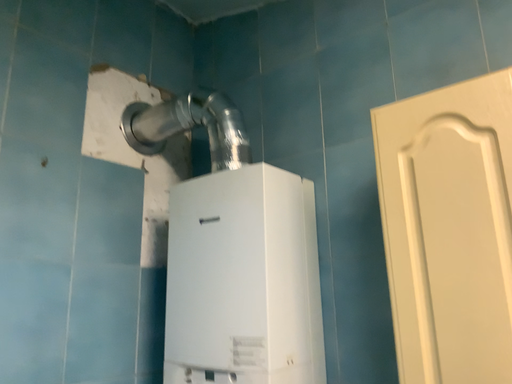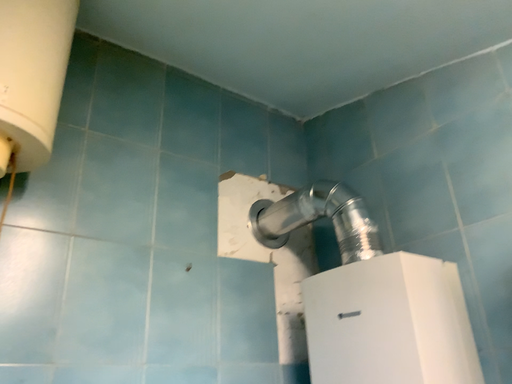
Question: Which way did the camera rotate in the video?

Choices:
 (A) rotated left
 (B) rotated right

Answer: (A)